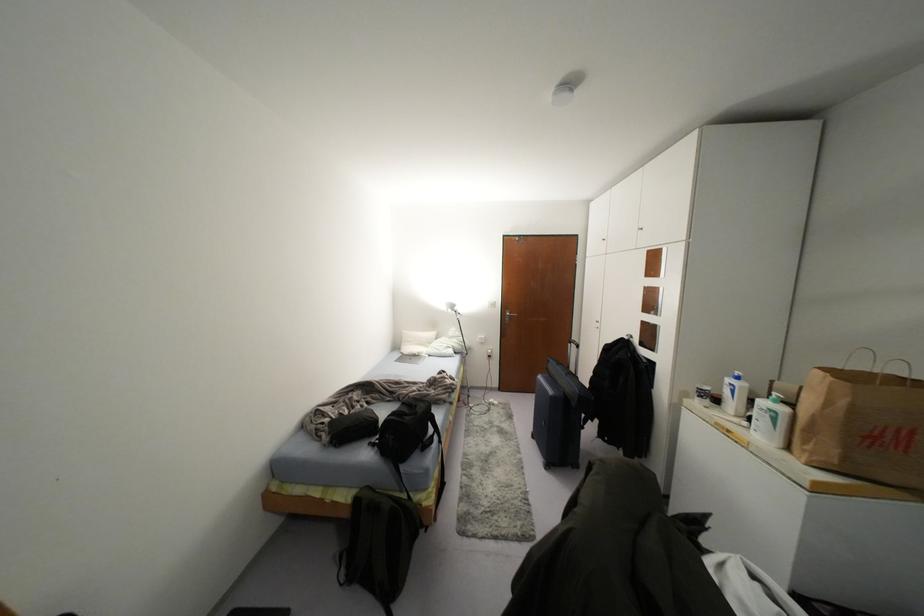
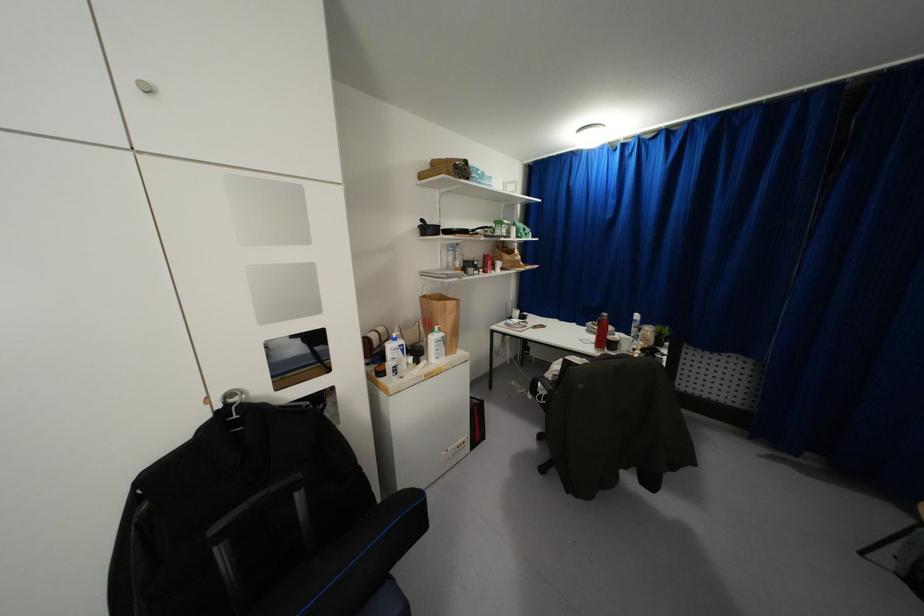
The point at [782,408] is marked in the first image. Where is the corresponding point in the second image?

(442, 333)